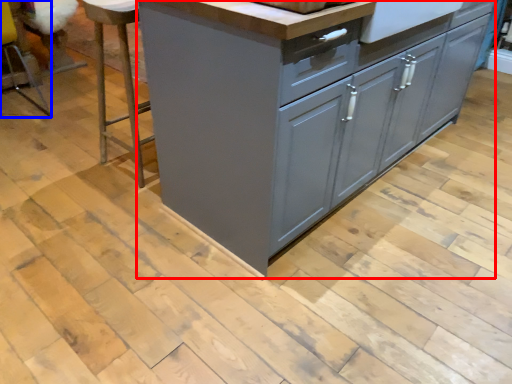
Question: Among these objects, which one is farthest to the camera, chest of drawers (highlighted by a red box) or bar stool (highlighted by a blue box)?

Choices:
 (A) chest of drawers
 (B) bar stool

Answer: (B)